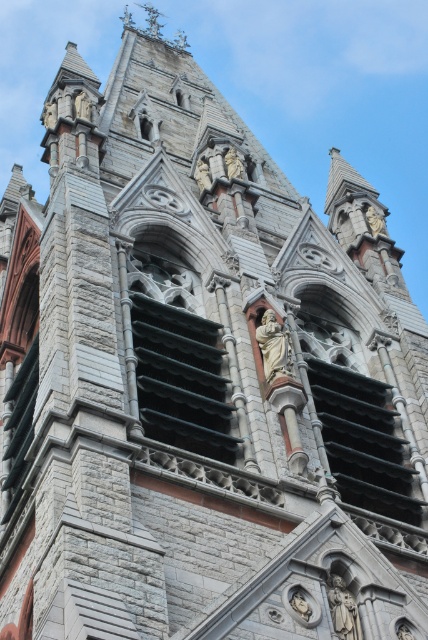
Can you confirm if polished stone statue at center is thinner than polished bronze statue at center?

Yes, polished stone statue at center is thinner than polished bronze statue at center.

Who is higher up, polished stone statue at center or polished bronze statue at center?

polished stone statue at center

Who is more forward, (278,365) or (350,612)?

Point (350,612) is in front.

This screenshot has width=428, height=640. Identify the location of polished stone statue at center. (273, 346).

Does point (377, 227) come farther from viewer compared to point (225, 164)?

Yes.

Is gold statue at upper right thinner than gray stone statue at center?

No, gold statue at upper right is not thinner than gray stone statue at center.

Who is more distant from viewer, (365, 212) or (237, 160)?

Point (365, 212)

Identify the location of gold statue at upper right. (374, 221).

Is polished stone statue at center to the right of gold statue at upper right from the viewer's perspective?

In fact, polished stone statue at center is to the left of gold statue at upper right.

Between polished stone statue at center and gold statue at upper right, which one is positioned lower?

Positioned lower is polished stone statue at center.

Who is more distant from viewer, (273, 339) or (369, 228)?

Point (369, 228)

This screenshot has width=428, height=640. Identify the location of polished stone statue at center. (273, 346).